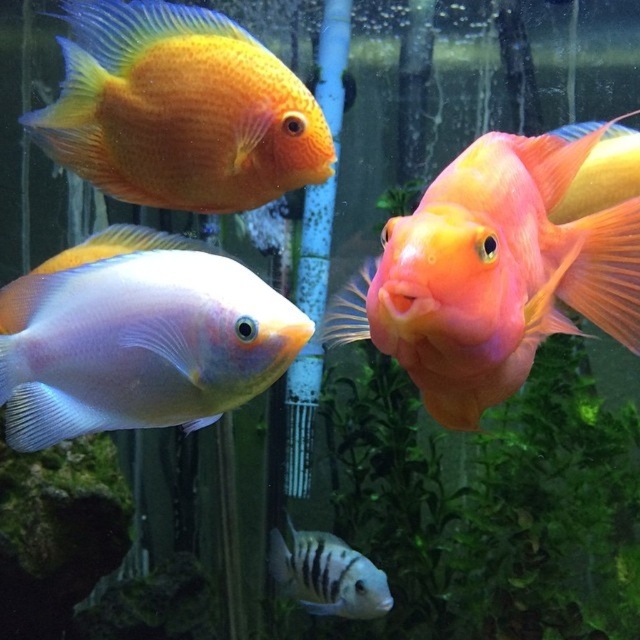
Is translucent white fish at center above shiny orange fish at upper center?

Incorrect, translucent white fish at center is not positioned above shiny orange fish at upper center.

Is translucent white fish at center positioned at the back of shiny orange fish at upper center?

No, translucent white fish at center is closer to the viewer.

Image resolution: width=640 pixels, height=640 pixels. In order to click on translucent white fish at center in this screenshot , I will do `click(138, 339)`.

What are the coordinates of `translucent white fish at center` in the screenshot? It's located at (138, 339).

Between shiny orange fish at center and black striped fish at lower center, which one appears on the right side from the viewer's perspective?

shiny orange fish at center is more to the right.

Does shiny orange fish at center appear over black striped fish at lower center?

Indeed, shiny orange fish at center is positioned over black striped fish at lower center.

Where is `shiny orange fish at center`? The width and height of the screenshot is (640, 640). shiny orange fish at center is located at coordinates (492, 273).

Who is lower down, shiny orange fish at upper center or black striped fish at lower center?

black striped fish at lower center is lower down.

Which of these two, shiny orange fish at upper center or black striped fish at lower center, stands shorter?

black striped fish at lower center is shorter.

What do you see at coordinates (179, 109) in the screenshot? I see `shiny orange fish at upper center` at bounding box center [179, 109].

This screenshot has width=640, height=640. Identify the location of shiny orange fish at upper center. (179, 109).